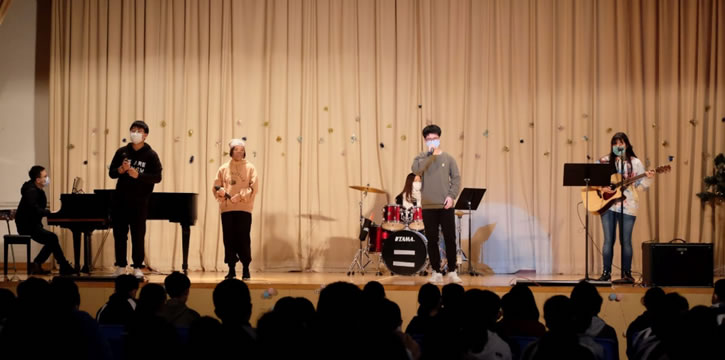
Where is `piano`? The height and width of the screenshot is (360, 725). piano is located at coordinates pos(74,205), pos(183,199), pos(185,262), pos(78,258).